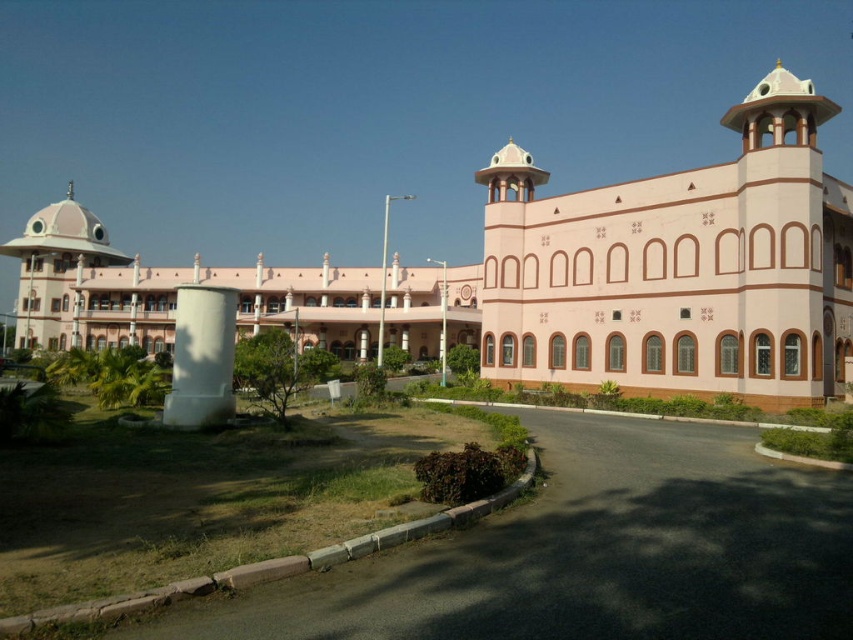
You are standing at the entrance of the pink stone building at center. If you walk straight ahead, will you immediately encounter the lawn or the pathway?

The question cannot be answered with the provided information.

You are standing on the lawn in front of the pink stucco building at center and the pink stone building at center. You want to walk to the paved pathway that is 10 meters away from both buildings. Can you reach the pathway without crossing between the two buildings?

The pink stucco building at center is 6.81 meters from the pink stone building at center. Since the pathway is 10 meters away from both buildings, you can reach it without crossing between the two buildings as the distance between them is less than 10 meters.